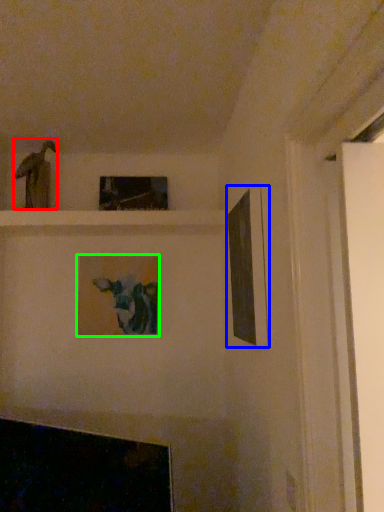
Question: Which object is positioned closest to art (highlighted by a red box)? Select from picture frame (highlighted by a blue box) and picture frame (highlighted by a green box).

Choices:
 (A) picture frame
 (B) picture frame

Answer: (B)